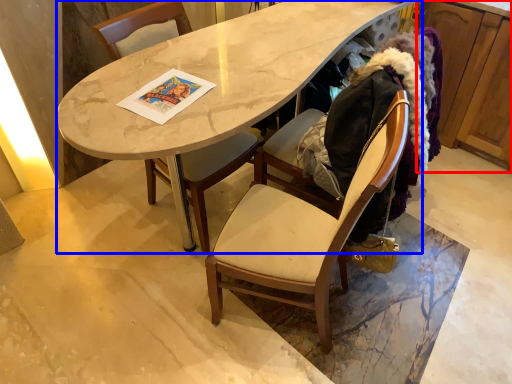
Question: Which point is further to the camera, cabinetry (highlighted by a red box) or desk (highlighted by a blue box)?

Choices:
 (A) cabinetry
 (B) desk

Answer: (A)